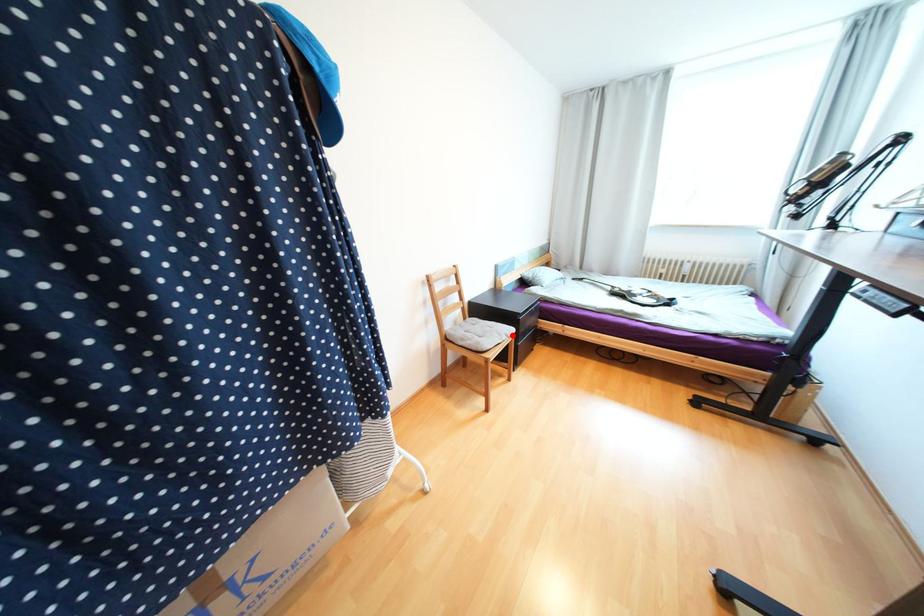
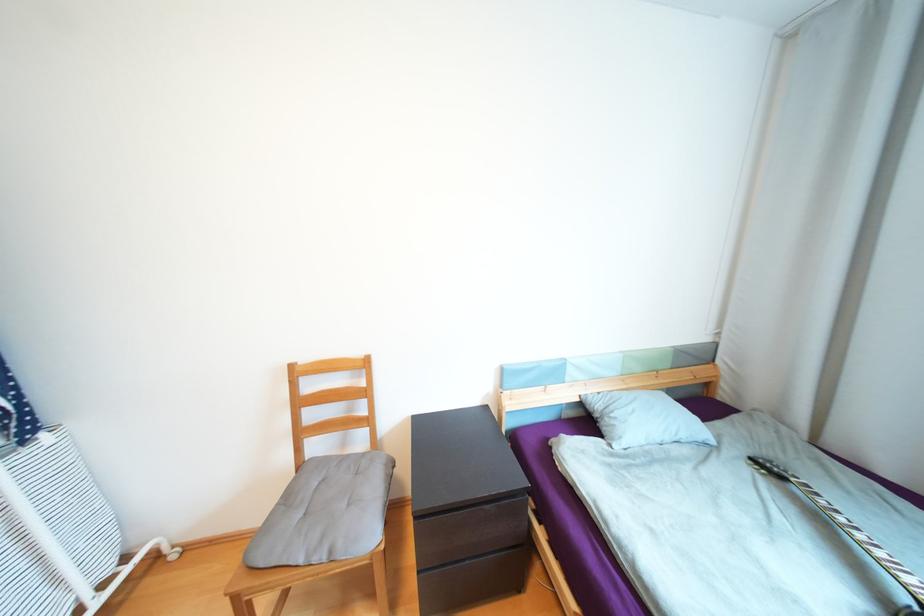
Where in the second image is the point corresponding to the highlighted location from the first image?

(335, 553)